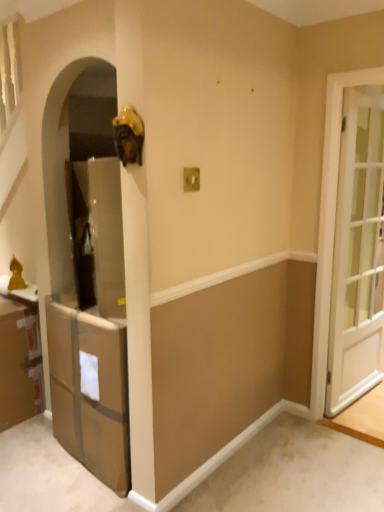
Question: From the image's perspective, is brown cardboard cabinet at lower left, the 2th cabinetry from the right, located above or below white glossy door at right?

Choices:
 (A) below
 (B) above

Answer: (A)

Question: Is brown cardboard cabinet at lower left, positioned as the first cabinetry in left-to-right order, in front of or behind white glossy door at right in the image?

Choices:
 (A) front
 (B) behind

Answer: (B)

Question: Which of these objects is positioned closest to the brown cardboard cabinet at lower left, the 2th cabinetry from the right?

Choices:
 (A) brown cardboard cabinet at lower left, acting as the first cabinetry starting from the right
 (B) white glossy door at right

Answer: (A)

Question: Considering the real-world distances, which object is farthest from the brown cardboard cabinet at lower left, the 2th cabinetry from the right?

Choices:
 (A) brown cardboard cabinet at lower left, acting as the first cabinetry starting from the right
 (B) white glossy door at right

Answer: (B)